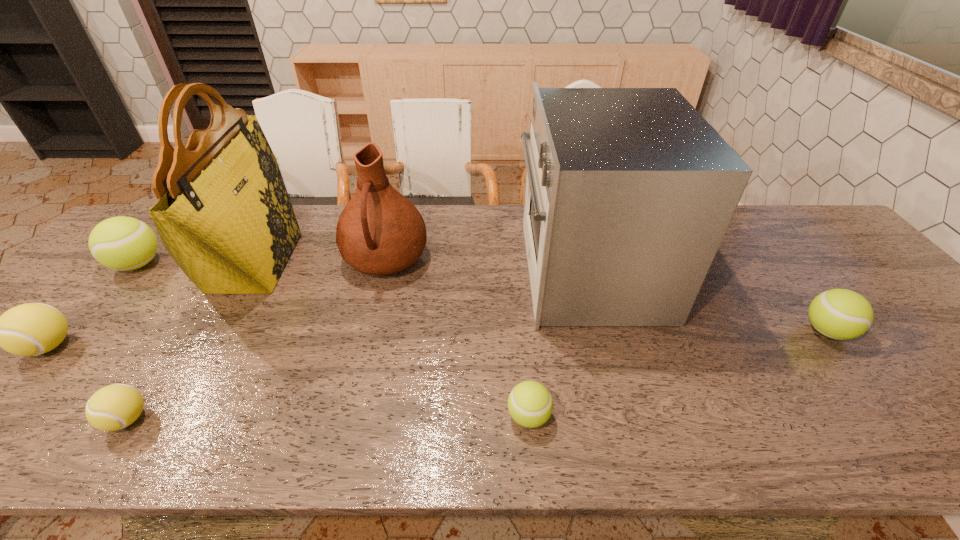
Identify the location of vacant space located 0.150m on the back of the farther yellow tennis ball. (105, 286).

Where is `vacant region located on the left of the rightmost green tennis ball`? vacant region located on the left of the rightmost green tennis ball is located at coordinates (684, 331).

Locate an element on the screen. free space located on the back of the smaller yellow tennis ball is located at coordinates (174, 348).

The width and height of the screenshot is (960, 540). I want to click on free spot located on the right of the fourth tennis ball from left to right, so click(x=624, y=416).

The height and width of the screenshot is (540, 960). What are the coordinates of `tote bag that is positioned at the far edge` in the screenshot? It's located at (224, 215).

The image size is (960, 540). I want to click on toaster oven that is positioned at the far edge, so click(x=629, y=192).

What are the coordinates of `pitcher that is at the far edge` in the screenshot? It's located at (380, 232).

Where is `tennis ball that is at the far edge`? tennis ball that is at the far edge is located at coordinates (122, 243).

The image size is (960, 540). Identify the location of object that is at the far left corner. (122, 243).

In the image, there is a desktop. Where is `vacant space at the far edge`? The width and height of the screenshot is (960, 540). vacant space at the far edge is located at coordinates (443, 245).